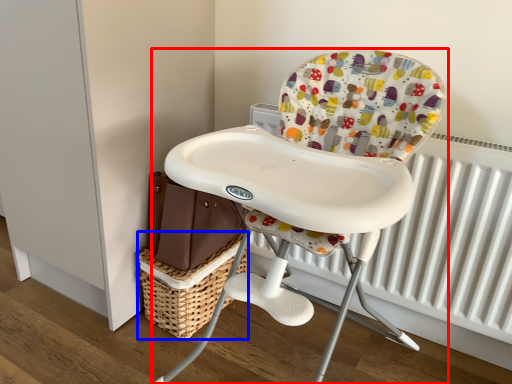
Question: Which of the following is the closest to the observer, chair (highlighted by a red box) or basket (highlighted by a blue box)?

Choices:
 (A) chair
 (B) basket

Answer: (A)